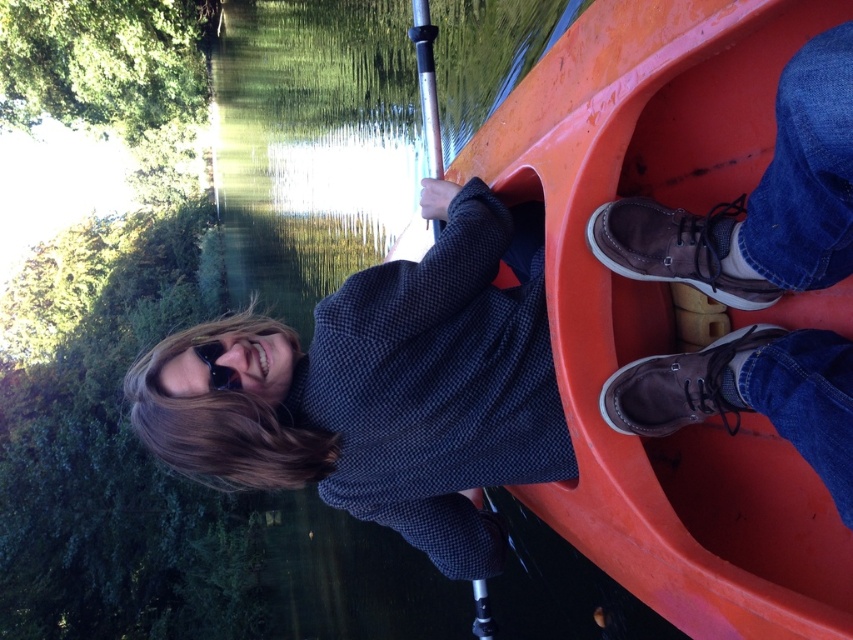
Who is lower down, orange matte plastic boat at center or silver metallic paddle at center?

orange matte plastic boat at center is lower down.

Which is in front, point (573, 100) or point (485, 586)?

Point (573, 100) is more forward.

Identify the location of orange matte plastic boat at center. [x=666, y=308].

Is point (717, 444) positioned before point (714, 227)?

That is False.

Looking at this image, can you confirm if orange matte plastic boat at center is taller than brown suede shoes at lower right?

Yes.

Between point (659, 602) and point (779, 198), which one is positioned in front?

Positioned in front is point (779, 198).

The width and height of the screenshot is (853, 640). What are the coordinates of `orange matte plastic boat at center` in the screenshot? It's located at (666, 308).

Who is more distant from viewer, (820,448) or (486,600)?

The point (486,600) is more distant.

Is brown suede shoes at lower right closer to camera compared to silver metallic paddle at center?

Yes, brown suede shoes at lower right is in front of silver metallic paddle at center.

Which is in front, point (844, 269) or point (424, 113)?

Point (844, 269)

You are a GUI agent. You are given a task and a screenshot of the screen. Output one action in this format:
    pyautogui.click(x=<x>, y=<y>)
    Task: Click on the brown suede shoes at lower right
    
    Given the screenshot: What is the action you would take?
    pyautogui.click(x=759, y=200)